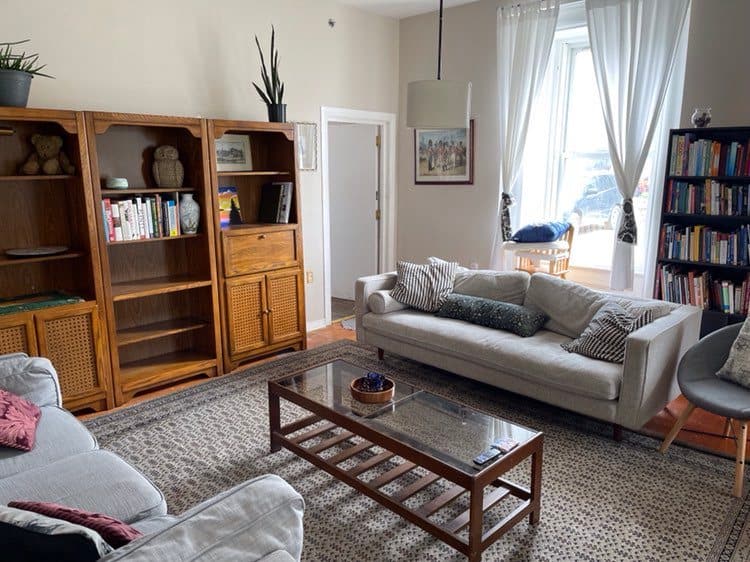
Image resolution: width=750 pixels, height=562 pixels. Identify the location of bookshelf. (145, 219), (741, 216).